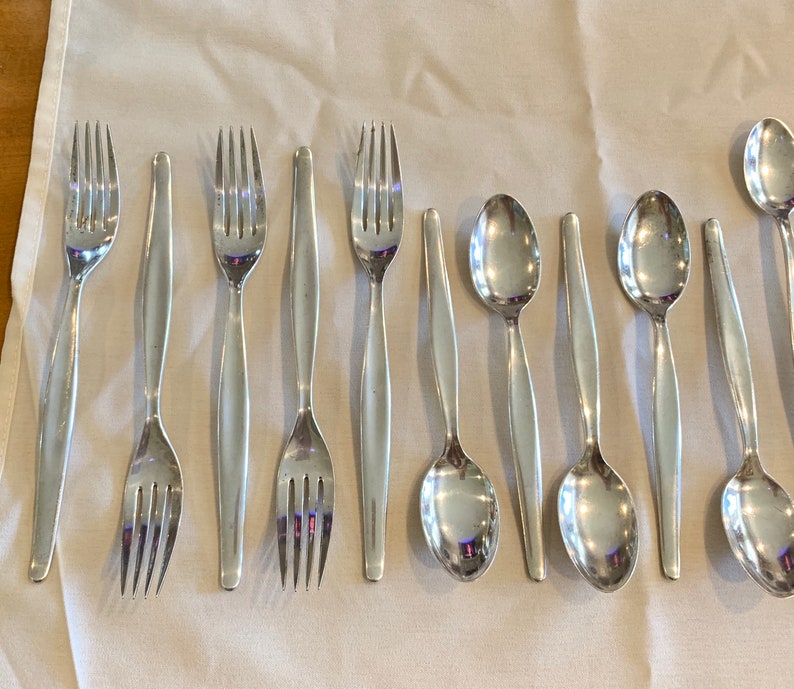
Identify the location of four leftmost pieces of silverware. The height and width of the screenshot is (689, 794). (63, 362), (149, 357), (226, 380), (305, 342).